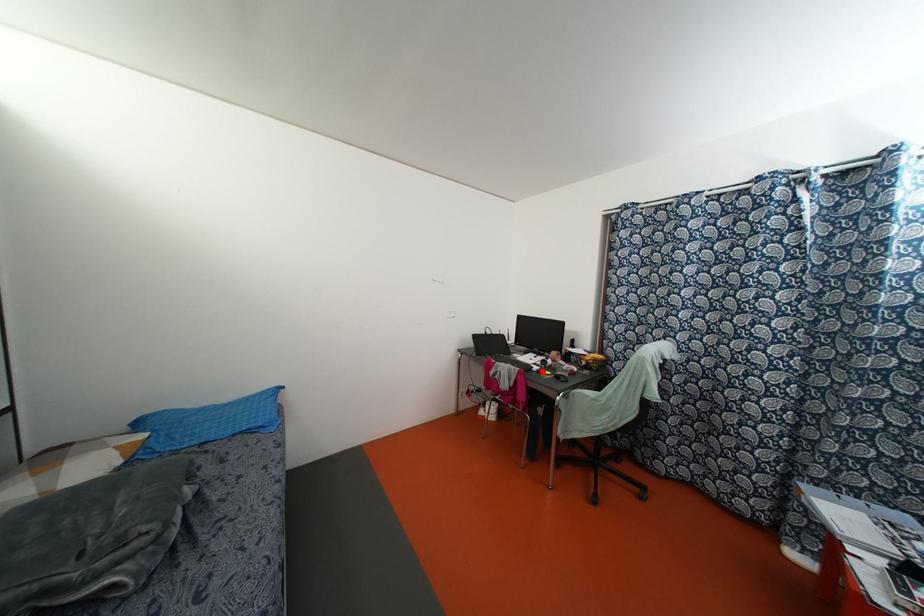
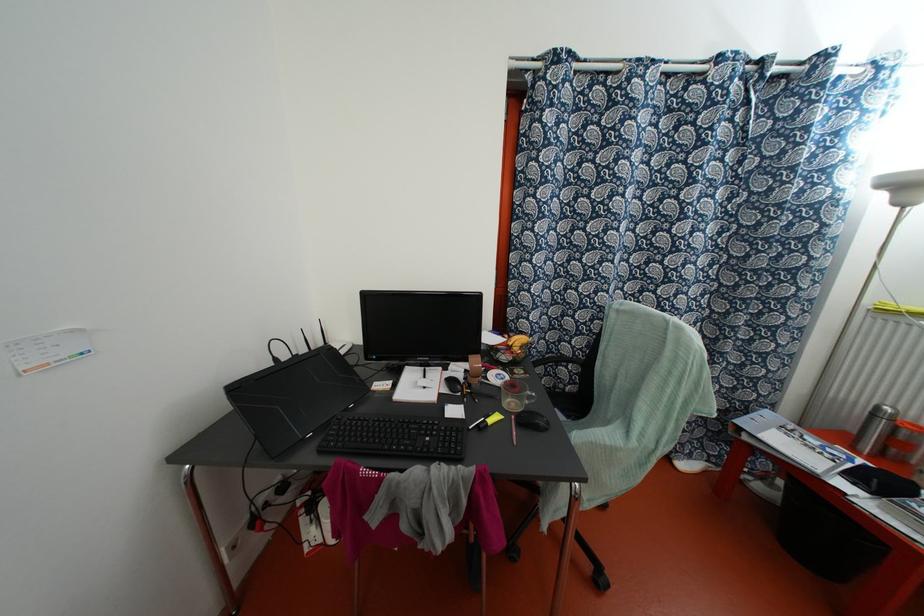
Find the pixel in the second image that matches the highlighted location in the first image.

(489, 421)